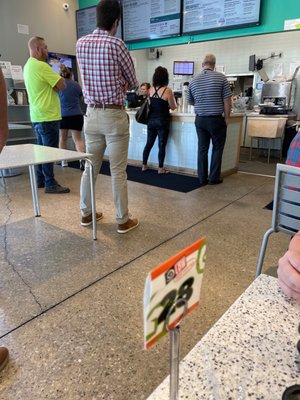
Locate an element on the screen. Image resolution: width=300 pixels, height=400 pixels. tile counter is located at coordinates (177, 138).